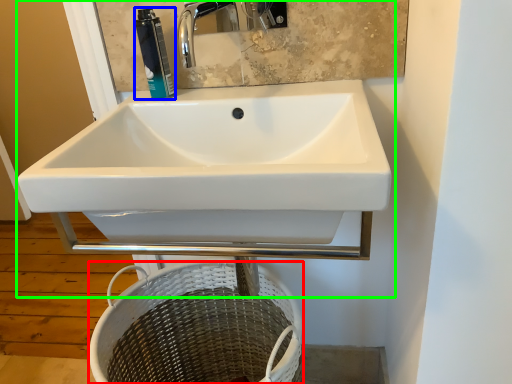
Question: Estimate the real-world distances between objects in this image. Which object is farther from basket (highlighted by a red box), toiletry (highlighted by a blue box) or sink (highlighted by a green box)?

Choices:
 (A) toiletry
 (B) sink

Answer: (A)